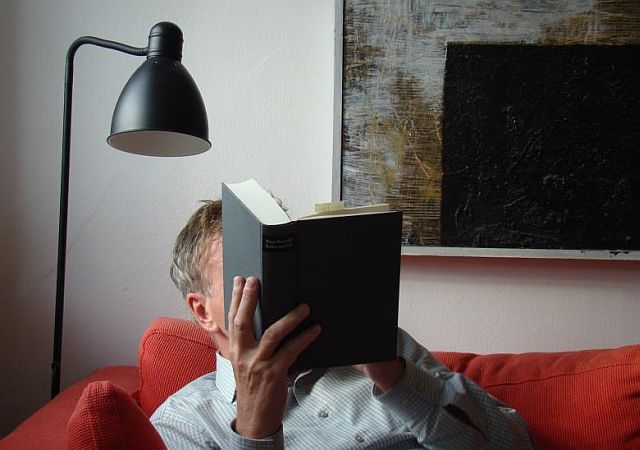
This screenshot has width=640, height=450. I want to click on couch, so click(531, 389).